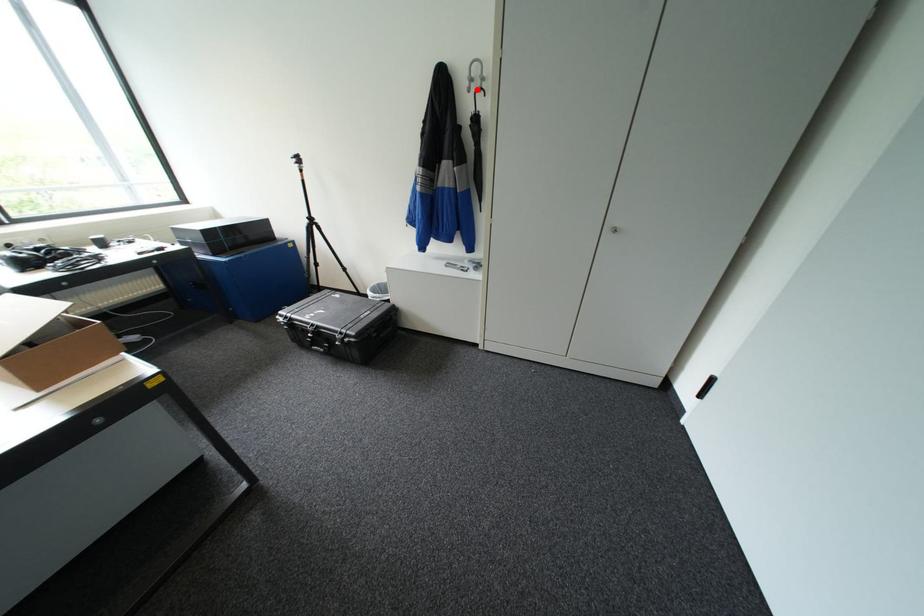
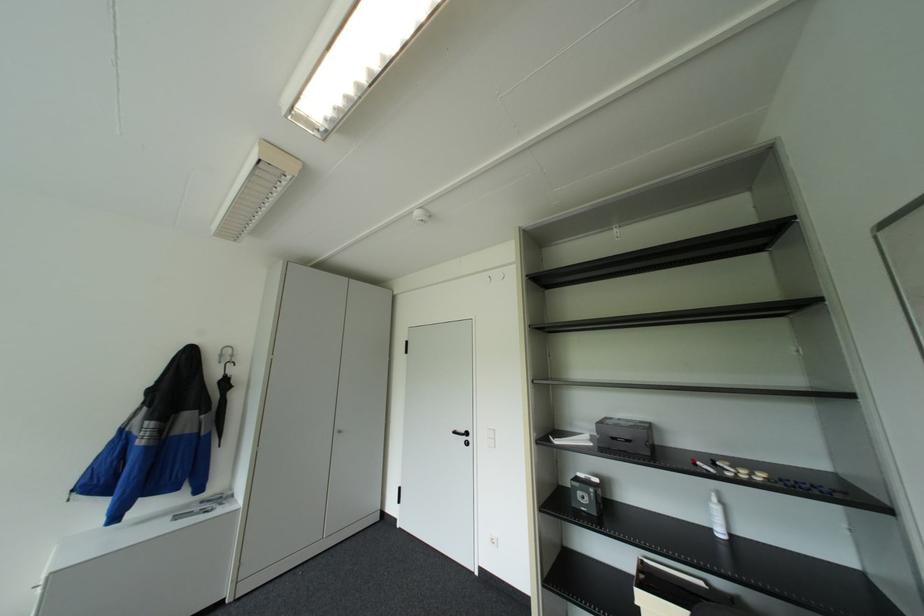
Question: I am providing you with two images of the same scene from different viewpoints. Image1 has a red point marked. In image2, the corresponding 3D location appears at what relative position? Reply with the corresponding letter.

Choices:
 (A) Closer
 (B) Farther

Answer: (B)